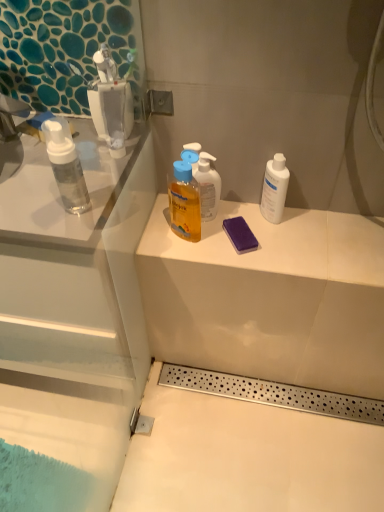
At what (x,y) coordinates should I click in order to perform the action: click on free point above matte white counter at center (from a real-world perspective). Please return your answer as a coordinate pair (x, y). Looking at the image, I should click on (269, 237).